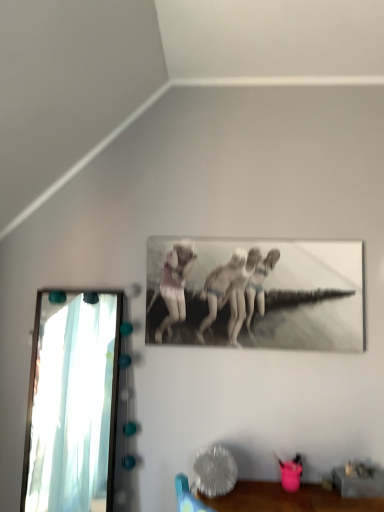
The height and width of the screenshot is (512, 384). Identify the location of white sheer curtain at left. (72, 402).

What do you see at coordinates (72, 402) in the screenshot? This screenshot has width=384, height=512. I see `white sheer curtain at left` at bounding box center [72, 402].

Where is `white sheer curtain at left`? The height and width of the screenshot is (512, 384). white sheer curtain at left is located at coordinates (72, 402).